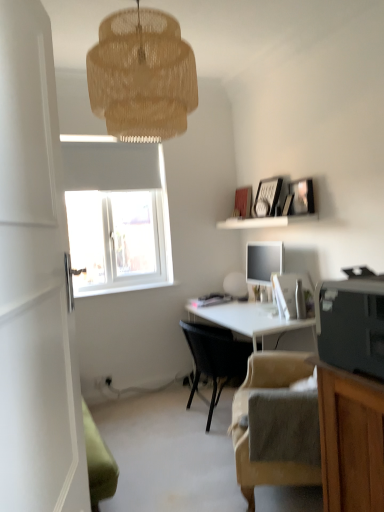
Question: From a real-world perspective, is woven beige lampshade at upper center over beige fabric chair at lower right, which is the 1th chair in front-to-back order?

Choices:
 (A) yes
 (B) no

Answer: (A)

Question: Is woven beige lampshade at upper center not inside beige fabric chair at lower right, which is the 1th chair in front-to-back order?

Choices:
 (A) no
 (B) yes

Answer: (B)

Question: Considering the relative positions of woven beige lampshade at upper center and beige fabric chair at lower right, which is the 1th chair in front-to-back order, in the image provided, is woven beige lampshade at upper center in front of beige fabric chair at lower right, which is the 1th chair in front-to-back order,?

Choices:
 (A) yes
 (B) no

Answer: (A)

Question: Does woven beige lampshade at upper center have a greater height compared to beige fabric chair at lower right, which is the 1th chair in front-to-back order?

Choices:
 (A) yes
 (B) no

Answer: (A)

Question: Is woven beige lampshade at upper center smaller than beige fabric chair at lower right, which is the 1th chair in front-to-back order?

Choices:
 (A) no
 (B) yes

Answer: (A)

Question: Is white glossy door at left to the left or to the right of beige fabric chair at lower right, the second chair from the back, in the image?

Choices:
 (A) right
 (B) left

Answer: (B)

Question: From a real-world perspective, relative to beige fabric chair at lower right, which is the 1th chair in front-to-back order, is white glossy door at left vertically above or below?

Choices:
 (A) below
 (B) above

Answer: (B)

Question: Is white glossy door at left inside or outside of beige fabric chair at lower right, the second chair from the back?

Choices:
 (A) outside
 (B) inside

Answer: (A)

Question: Considering the positions of white glossy door at left and beige fabric chair at lower right, the second chair from the back, in the image, is white glossy door at left bigger or smaller than beige fabric chair at lower right, the second chair from the back,?

Choices:
 (A) small
 (B) big

Answer: (A)

Question: Which is correct: white glossy door at left is inside white glossy desk at center, or outside of it?

Choices:
 (A) outside
 (B) inside

Answer: (A)

Question: From a real-world perspective, is white glossy door at left positioned above or below white glossy desk at center?

Choices:
 (A) below
 (B) above

Answer: (B)

Question: Is white glossy door at left to the left or to the right of white glossy desk at center in the image?

Choices:
 (A) left
 (B) right

Answer: (A)

Question: Based on their sizes in the image, would you say white glossy door at left is bigger or smaller than white glossy desk at center?

Choices:
 (A) small
 (B) big

Answer: (A)

Question: Would you say white glossy desk at center is to the left or to the right of beige fabric chair at lower right, which is the 1th chair in front-to-back order, in the picture?

Choices:
 (A) left
 (B) right

Answer: (B)

Question: From a real-world perspective, is white glossy desk at center positioned above or below beige fabric chair at lower right, which is the 1th chair in front-to-back order?

Choices:
 (A) below
 (B) above

Answer: (A)